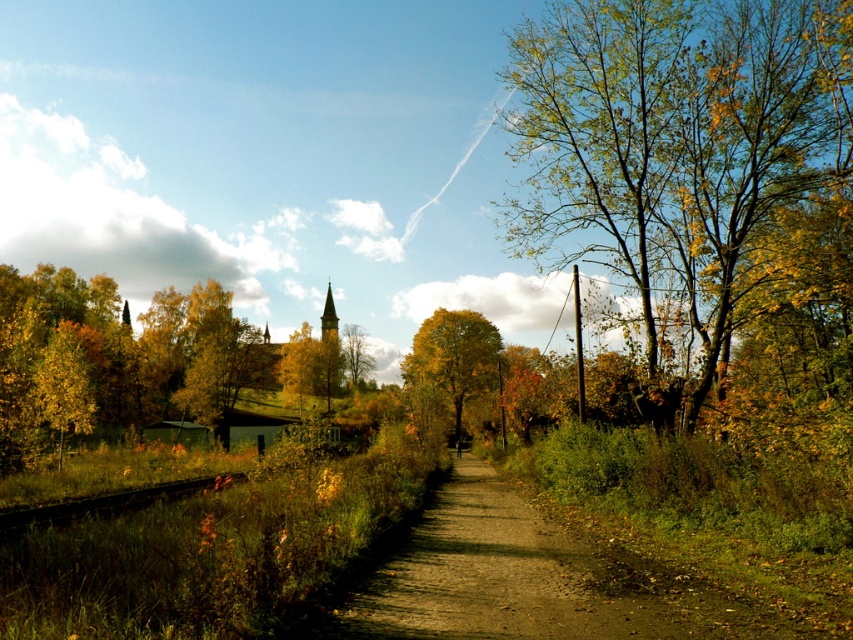
Question: Which object appears farthest from the camera in this image?

Choices:
 (A) brown gravel path at center
 (B) smooth gray steeple at center
 (C) yellow-green foliage at center
 (D) golden yellow leaves at center

Answer: (B)

Question: Which of the following is the closest to the observer?

Choices:
 (A) smooth gray steeple at center
 (B) green leafy tree at right
 (C) yellow-green foliage at center

Answer: (B)

Question: Does yellow-green foliage at center appear on the right side of smooth gray steeple at center?

Choices:
 (A) yes
 (B) no

Answer: (A)

Question: Which point appears farthest from the camera in this image?

Choices:
 (A) (363, 637)
 (B) (424, 332)
 (C) (112, 320)

Answer: (C)

Question: Is green leafy tree at right to the left of golden yellow leaves at center from the viewer's perspective?

Choices:
 (A) no
 (B) yes

Answer: (A)

Question: Considering the relative positions of brown gravel path at center and smooth gray steeple at center in the image provided, where is brown gravel path at center located with respect to smooth gray steeple at center?

Choices:
 (A) left
 (B) right

Answer: (B)